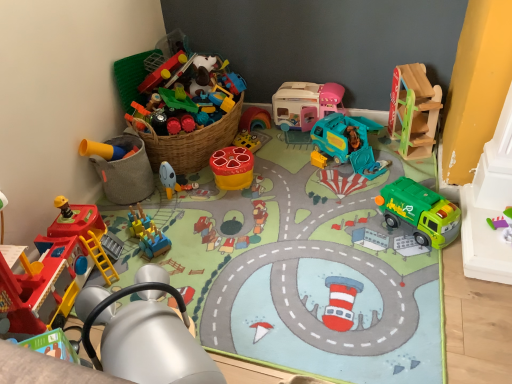
The height and width of the screenshot is (384, 512). What are the coordinates of `vacant area that is situated to the right of teal plastic garbage truck at center, acting as the 7th toy starting from the left` in the screenshot? It's located at (387, 157).